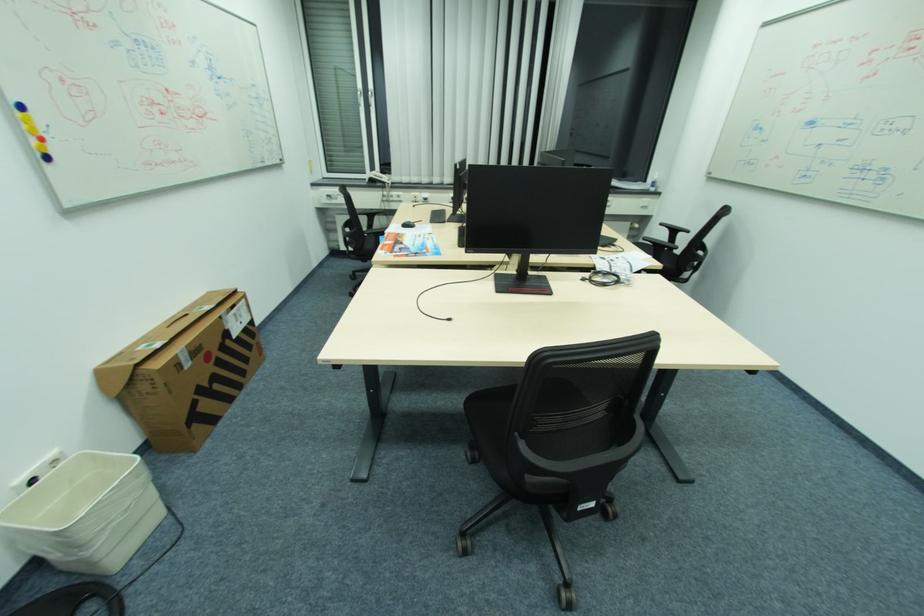
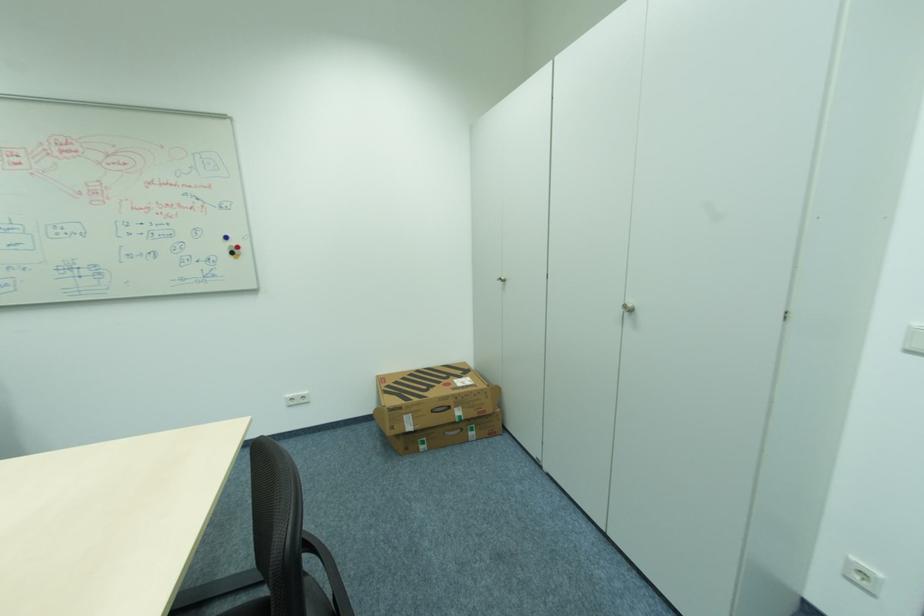
How did the camera likely rotate?

The camera rotated toward right-down.